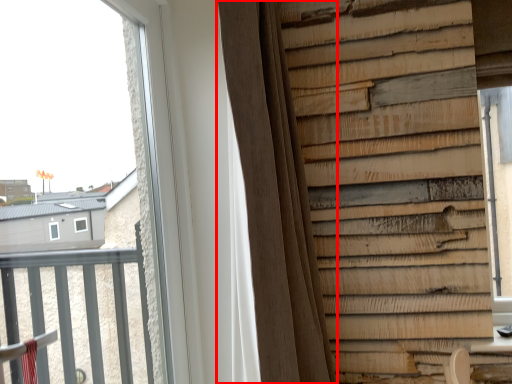
Question: In this image, where is curtain (annotated by the red box) located relative to window?

Choices:
 (A) right
 (B) left

Answer: (A)